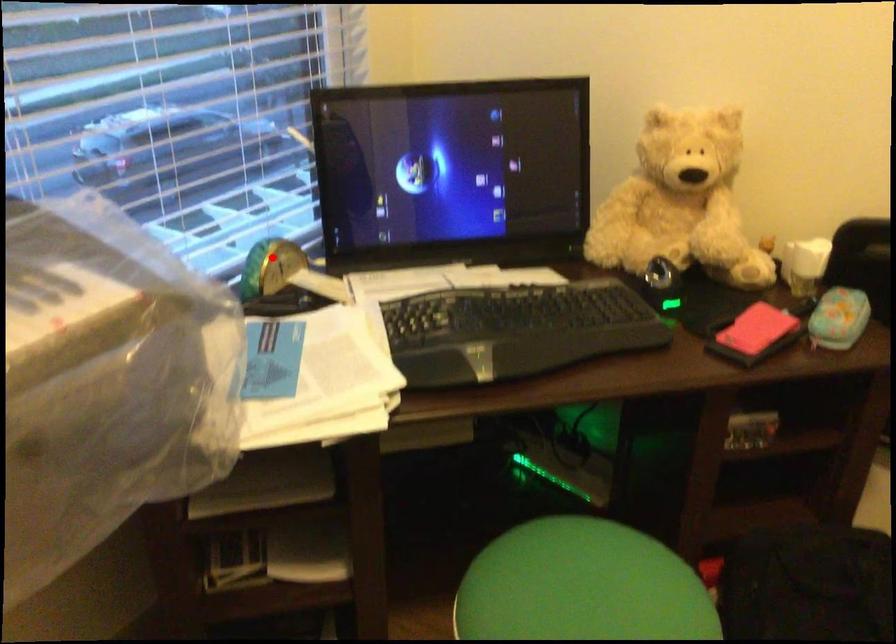
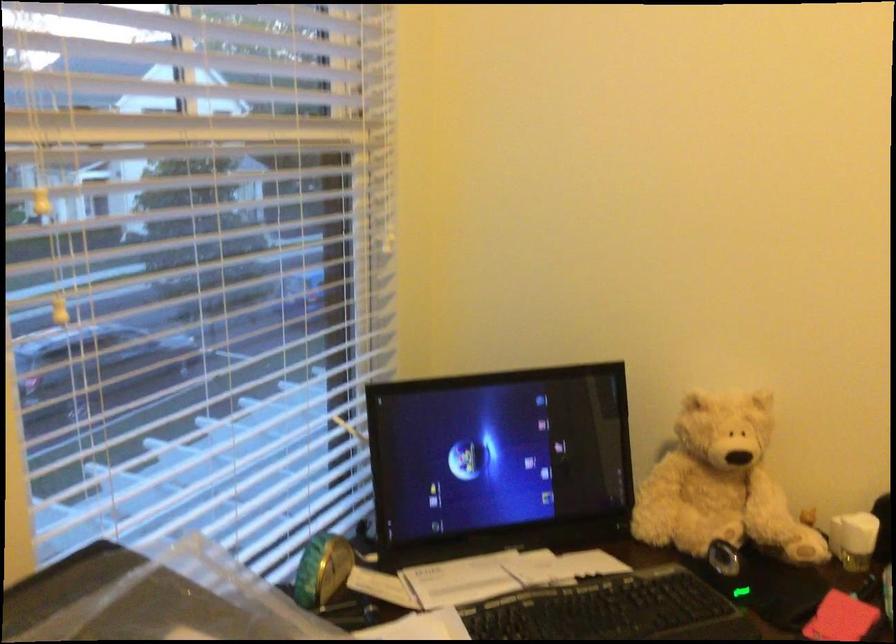
Locate, in the second image, the point that corresponds to the highlighted location in the first image.

(322, 569)